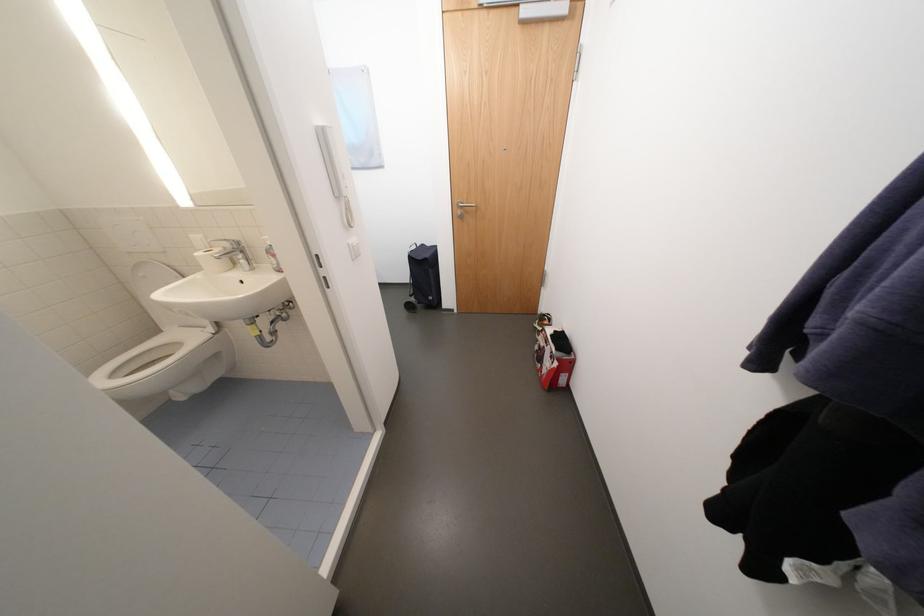
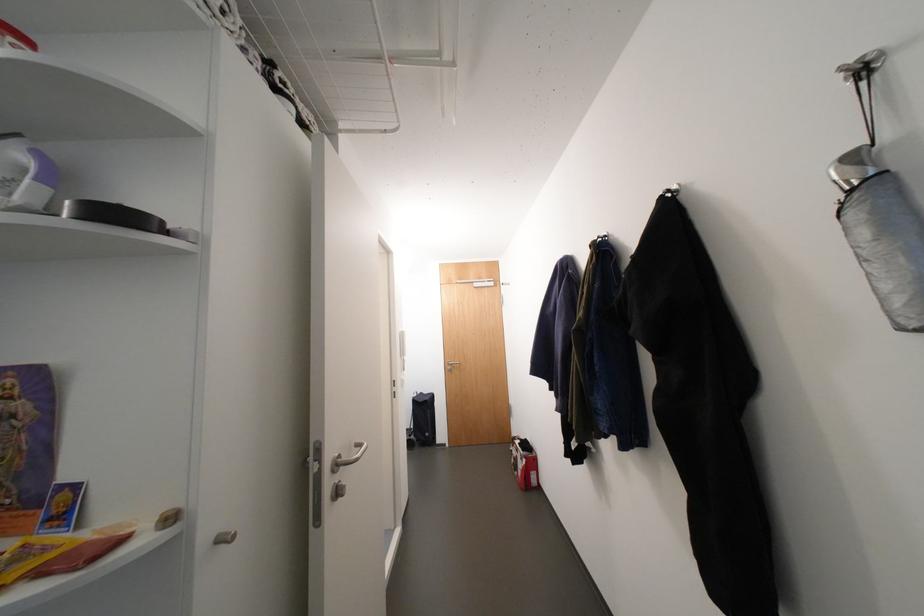
Find the pixel in the second image that matches point 552,371 in the first image.

(527, 474)